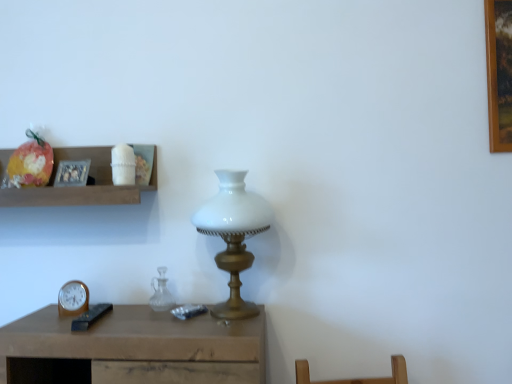
In the scene shown: Measure the distance between point [3,159] and camera.

They are 4.99 feet apart.

Measure the distance between wooden shelf at upper left and camera.

The distance of wooden shelf at upper left from camera is 1.33 meters.

What is the approximate height of metallic silver picture frame at upper left?

metallic silver picture frame at upper left is 4.99 inches tall.

What do you see at coordinates (72, 173) in the screenshot? I see `metallic silver picture frame at upper left` at bounding box center [72, 173].

What do you see at coordinates (30, 163) in the screenshot? I see `shiny plastic bag at upper left` at bounding box center [30, 163].

Locate an element on the screen. The image size is (512, 384). wooden shelf at upper left is located at coordinates (81, 187).

What's the angular difference between shiny plastic bag at upper left and white glass lamp at center's facing directions?

6.61 degrees.

Between shiny plastic bag at upper left and white glass lamp at center, which one has less height?

Standing shorter between the two is shiny plastic bag at upper left.

Is shiny plastic bag at upper left further to the viewer compared to white glass lamp at center?

Yes, it is behind white glass lamp at center.

Does transparent glass vase at center have a lesser height compared to white glass lamp at center?

Yes.

Is transparent glass vase at center oriented away from white glass lamp at center?

transparent glass vase at center is not turned away from white glass lamp at center.

Is transparent glass vase at center far from white glass lamp at center?

They are positioned close to each other.

Is wooden shelf at upper left not inside wooden clock at lower left?

wooden shelf at upper left is positioned outside wooden clock at lower left.

Who is taller, wooden shelf at upper left or wooden clock at lower left?

wooden shelf at upper left.

From the image's perspective, is wooden shelf at upper left above or below wooden clock at lower left?

From the image's perspective, wooden shelf at upper left appears above wooden clock at lower left.

Is the depth of wooden shelf at upper left greater than that of wooden clock at lower left?

No, wooden shelf at upper left is closer to the camera.

Is white glass lamp at center facing away from wooden shelf at upper left?

white glass lamp at center is not turned away from wooden shelf at upper left.

How many degrees apart are the facing directions of white glass lamp at center and wooden shelf at upper left?

They differ by 1.43 degrees in their facing directions.

Considering the sizes of objects white glass lamp at center and wooden shelf at upper left in the image provided, who is thinner, white glass lamp at center or wooden shelf at upper left?

wooden shelf at upper left is thinner.

Is white glass lamp at center inside or outside of wooden shelf at upper left?

white glass lamp at center is spatially situated outside wooden shelf at upper left.

I want to click on glass vase on the right of metallic silver picture frame at upper left, so click(x=161, y=292).

Is transparent glass vase at center facing away from metallic silver picture frame at upper left?

transparent glass vase at center does not have its back to metallic silver picture frame at upper left.

Is transparent glass vase at center to the left or to the right of metallic silver picture frame at upper left in the image?

Clearly, transparent glass vase at center is on the right of metallic silver picture frame at upper left in the image.

Which is closer to the camera, (55, 178) or (28, 146)?

Point (55, 178) is closer to the camera than point (28, 146).

From a real-world perspective, between metallic silver picture frame at upper left and shiny plastic bag at upper left, who is vertically lower?

metallic silver picture frame at upper left is physically lower.

Is metallic silver picture frame at upper left shorter than shiny plastic bag at upper left?

Yes, metallic silver picture frame at upper left is shorter than shiny plastic bag at upper left.

From the image's perspective, which object appears higher, metallic silver picture frame at upper left or shiny plastic bag at upper left?

shiny plastic bag at upper left.

Considering the sizes of wooden shelf at upper left and transparent glass vase at center in the image, is wooden shelf at upper left wider or thinner than transparent glass vase at center?

Considering their sizes, wooden shelf at upper left looks broader than transparent glass vase at center.

Who is smaller, wooden shelf at upper left or transparent glass vase at center?

Smaller between the two is transparent glass vase at center.

Based on their positions, is wooden shelf at upper left located to the left or right of transparent glass vase at center?

From the image, it's evident that wooden shelf at upper left is to the left of transparent glass vase at center.

Where is `fruit on the left side of white glass lamp at center`? fruit on the left side of white glass lamp at center is located at coordinates (30, 163).

This screenshot has height=384, width=512. In the image, there is a white glass lamp at center. What are the coordinates of `glass vase below it (from the image's perspective)` in the screenshot? It's located at (161, 292).

Looking at the image, which one is located further to metallic silver picture frame at upper left, transparent glass vase at center or shiny plastic bag at upper left?

Based on the image, transparent glass vase at center appears to be further to metallic silver picture frame at upper left.

Looking at the image, which one is located further to wooden clock at lower left, wooden shelf at upper left or white glass lamp at center?

white glass lamp at center is positioned further to the anchor wooden clock at lower left.

Looking at the image, which one is located closer to wooden shelf at upper left, white glass lamp at center or transparent glass vase at center?

white glass lamp at center is positioned closer to the anchor wooden shelf at upper left.

Estimate the real-world distances between objects in this image. Which object is closer to metallic silver picture frame at upper left, white glass lamp at center or transparent glass vase at center?

transparent glass vase at center lies closer to metallic silver picture frame at upper left than the other object.

Considering their positions, is wooden clock at lower left positioned closer to transparent glass vase at center than wooden shelf at upper left?

Among the two, wooden clock at lower left is located nearer to transparent glass vase at center.

Considering their positions, is metallic silver picture frame at upper left positioned closer to shiny plastic bag at upper left than wooden shelf at upper left?

metallic silver picture frame at upper left.

Considering their positions, is wooden shelf at upper left positioned further to wooden clock at lower left than shiny plastic bag at upper left?

shiny plastic bag at upper left lies further to wooden clock at lower left than the other object.

Estimate the real-world distances between objects in this image. Which object is further from metallic silver picture frame at upper left, wooden clock at lower left or transparent glass vase at center?

The object further to metallic silver picture frame at upper left is transparent glass vase at center.

This screenshot has height=384, width=512. Find the location of `shelf between metallic silver picture frame at upper left and transparent glass vase at center in the vertical direction`. shelf between metallic silver picture frame at upper left and transparent glass vase at center in the vertical direction is located at coordinates (81, 187).

Find the location of a particular element. The image size is (512, 384). shelf between shiny plastic bag at upper left and transparent glass vase at center in the horizontal direction is located at coordinates (81, 187).

Find the location of a particular element. The image size is (512, 384). clock situated between metallic silver picture frame at upper left and white glass lamp at center from left to right is located at coordinates (73, 299).

Locate an element on the screen. The image size is (512, 384). glass vase between metallic silver picture frame at upper left and white glass lamp at center from left to right is located at coordinates (161, 292).